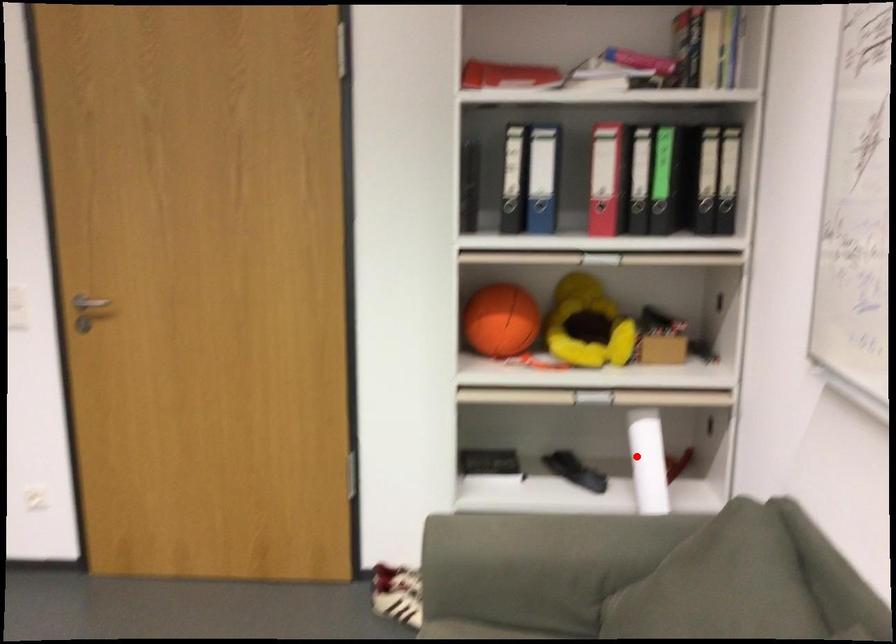
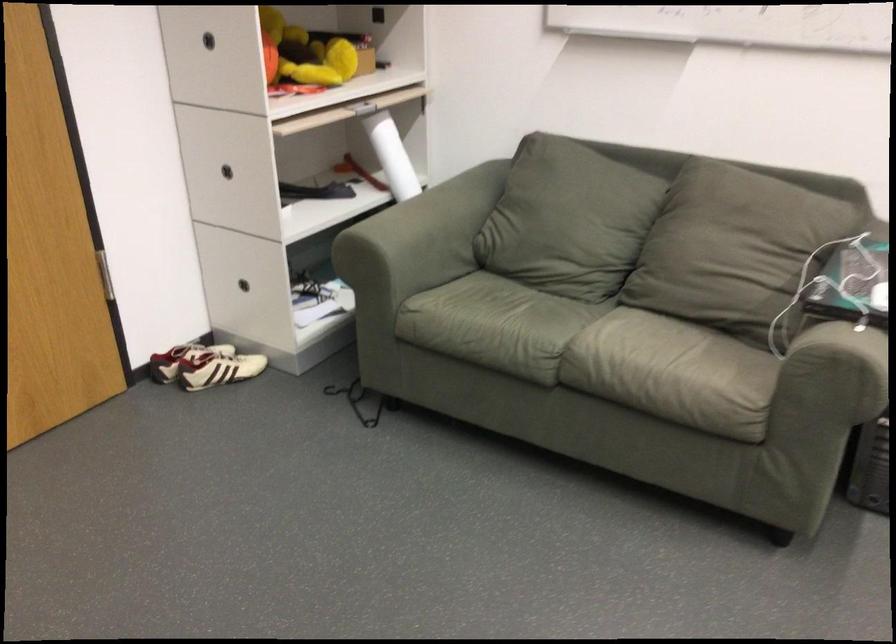
In the second image, find the point that corresponds to the highlighted location in the first image.

(392, 156)